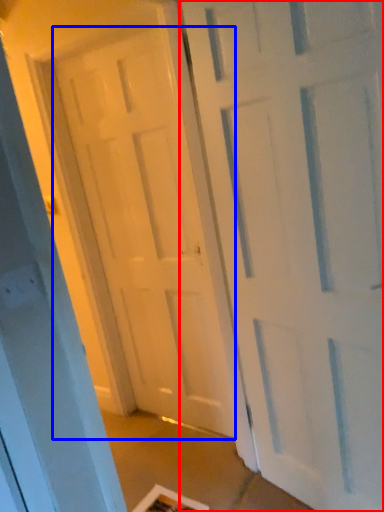
Question: Which object is further to the camera taking this photo, door (highlighted by a red box) or door (highlighted by a blue box)?

Choices:
 (A) door
 (B) door

Answer: (B)